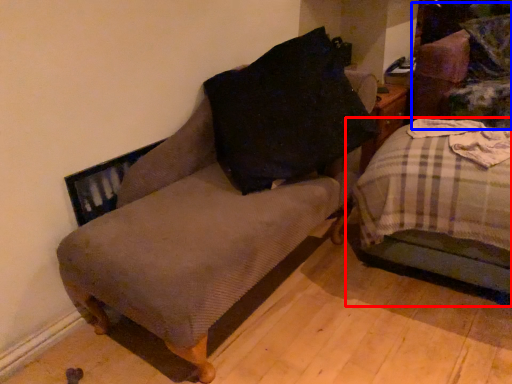
Question: Which point is further to the camera, studio couch (highlighted by a red box) or swivel chair (highlighted by a blue box)?

Choices:
 (A) studio couch
 (B) swivel chair

Answer: (B)